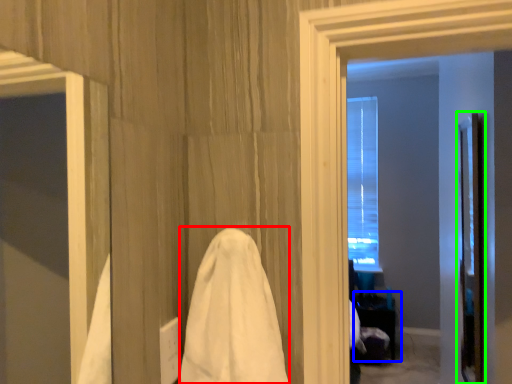
Question: Which object is the closest to the bath towel (highlighted by a red box)? Choose among these: table (highlighted by a blue box) or screen door (highlighted by a green box).

Choices:
 (A) table
 (B) screen door

Answer: (B)